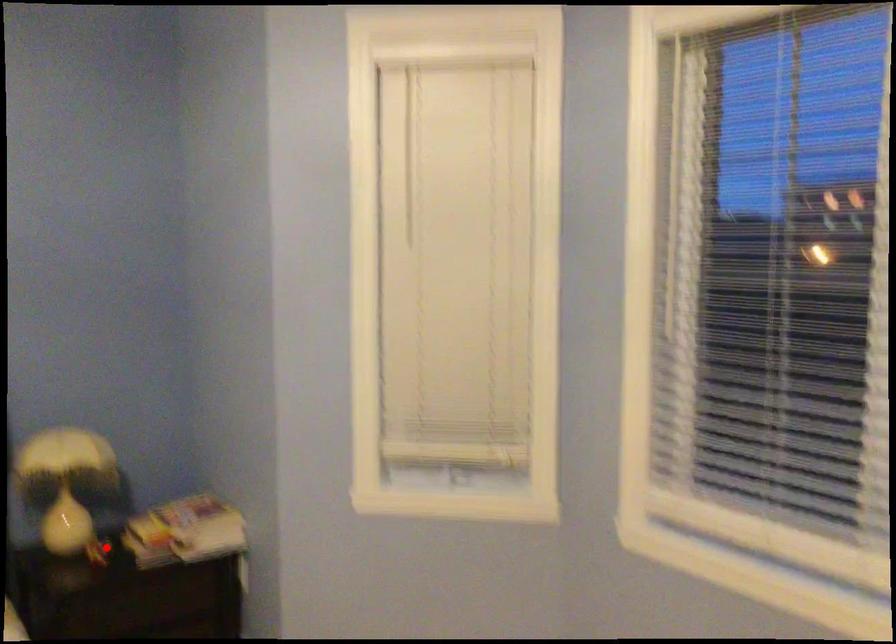
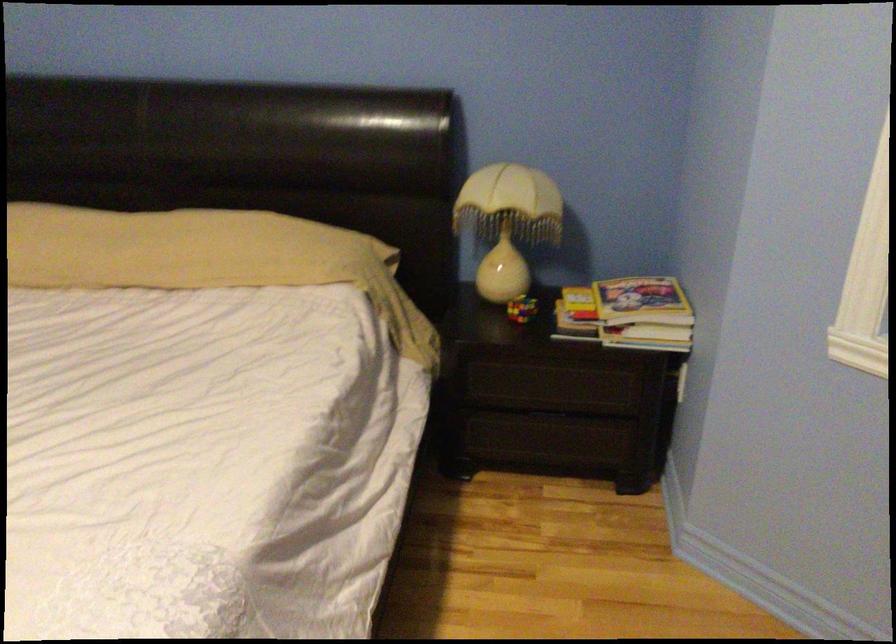
The point at the highlighted location is marked in the first image. Where is the corresponding point in the second image?

(521, 308)